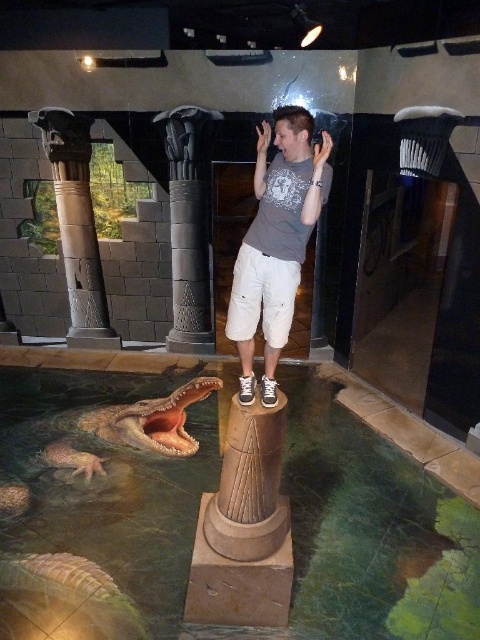
Does gray cotton t-shirt at center appear under brown stone column at left?

Correct, gray cotton t-shirt at center is located below brown stone column at left.

Measure the distance between point (257, 182) and camera.

Point (257, 182) is 10.54 feet from camera.

Who is more distant from viewer, (304, 216) or (107, 333)?

The point (107, 333) is more distant.

Identify the location of gray cotton t-shirt at center. (276, 243).